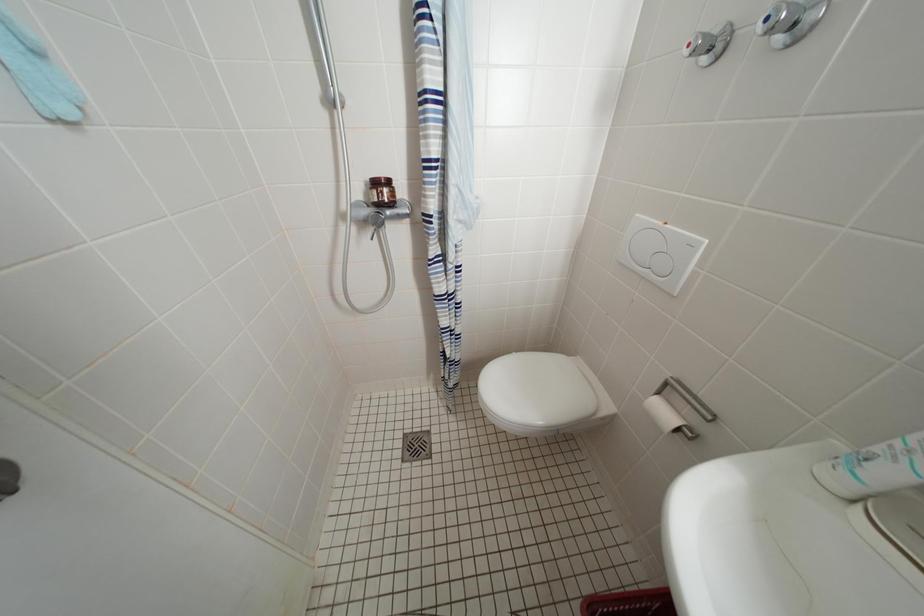
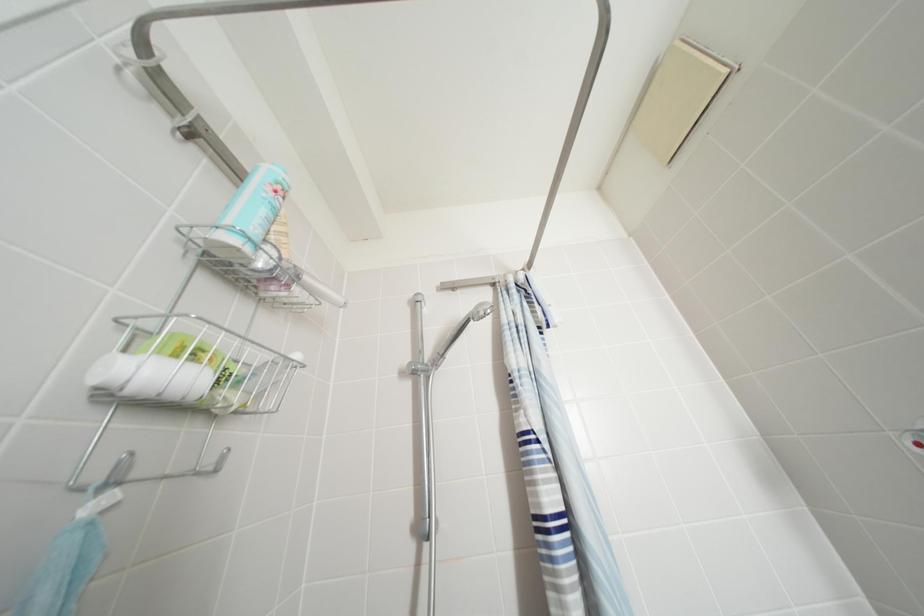
Question: The images are taken continuously from a first-person perspective. In which direction is your viewpoint rotating?

Choices:
 (A) Left
 (B) Right
 (C) Up
 (D) Down

Answer: (C)